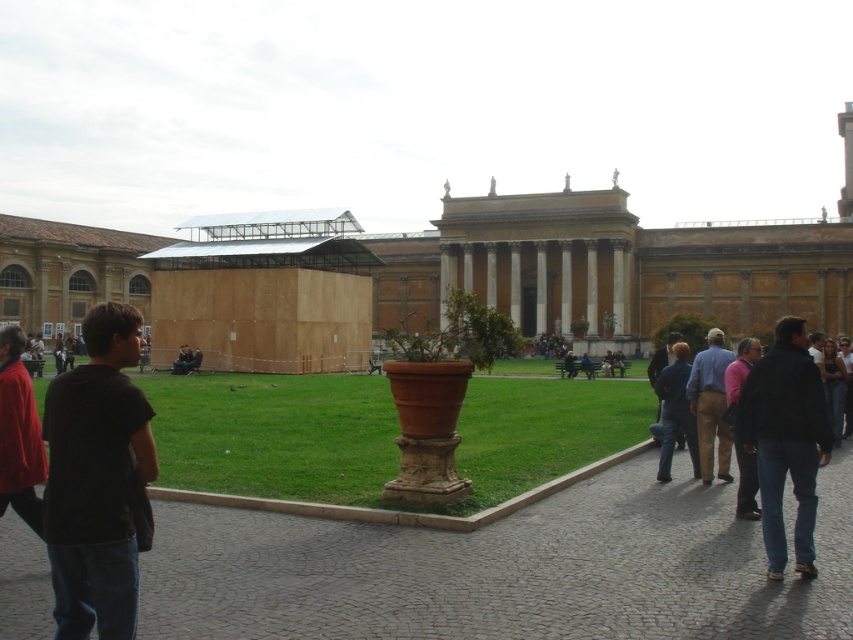
Question: Is black cotton shirt at left thinner than dark blue jeans at lower right?

Choices:
 (A) no
 (B) yes

Answer: (A)

Question: Does brown wooden structure at center lie in front of green grass at center?

Choices:
 (A) no
 (B) yes

Answer: (A)

Question: Which object is positioned farthest from the cobblestone path at center?

Choices:
 (A) pink fabric at lower right
 (B) green grass at center

Answer: (B)

Question: Estimate the real-world distances between objects in this image. Which object is closer to the blue shirt at center?

Choices:
 (A) black matte jacket at lower right
 (B) cobblestone path at center
 (C) pink fabric at lower right
 (D) dark blue jeans at lower right

Answer: (D)

Question: Which object appears farthest from the camera in this image?

Choices:
 (A) black cotton shirt at left
 (B) brown wooden structure at center
 (C) black matte jacket at lower right
 (D) green grass at center

Answer: (B)

Question: Is green grass at center bigger than dark blue jeans at lower right?

Choices:
 (A) yes
 (B) no

Answer: (A)